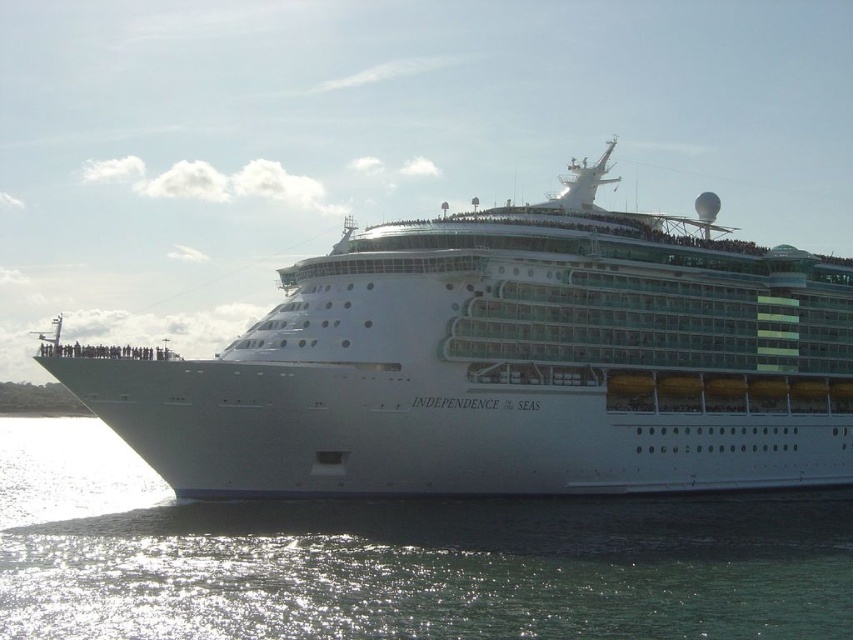
In the scene shown: Is white glossy cruise ship at center further to camera compared to clear water at lower left?

Yes, it is behind clear water at lower left.

What do you see at coordinates (508, 364) in the screenshot? This screenshot has height=640, width=853. I see `white glossy cruise ship at center` at bounding box center [508, 364].

Image resolution: width=853 pixels, height=640 pixels. What do you see at coordinates (508, 364) in the screenshot? I see `white glossy cruise ship at center` at bounding box center [508, 364].

Where is `white glossy cruise ship at center`? The width and height of the screenshot is (853, 640). white glossy cruise ship at center is located at coordinates (508, 364).